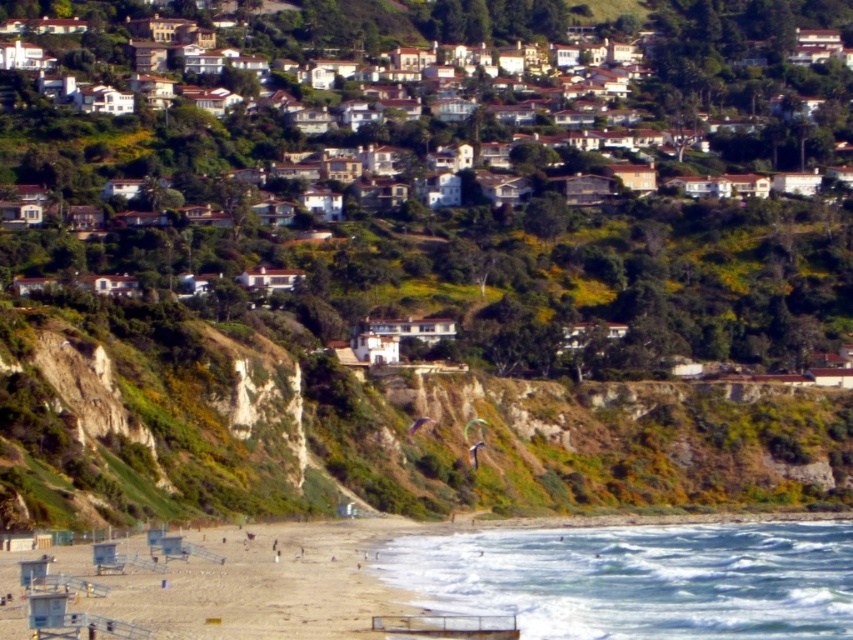
You are a drone operator tasked with capturing aerial footage of the white stucco houses at center and the beige sandy beach at lower left. Which object should you focus on first if you want to film the taller structure?

The white stucco houses at center should be focused on first because they have a greater height compared to the beige sandy beach at lower left.